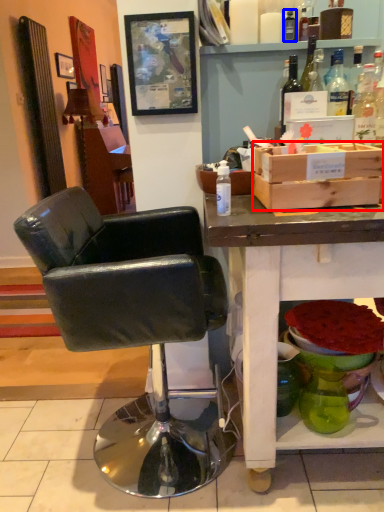
Question: Which point is closer to the camera, box (highlighted by a red box) or bottle (highlighted by a blue box)?

Choices:
 (A) box
 (B) bottle

Answer: (A)